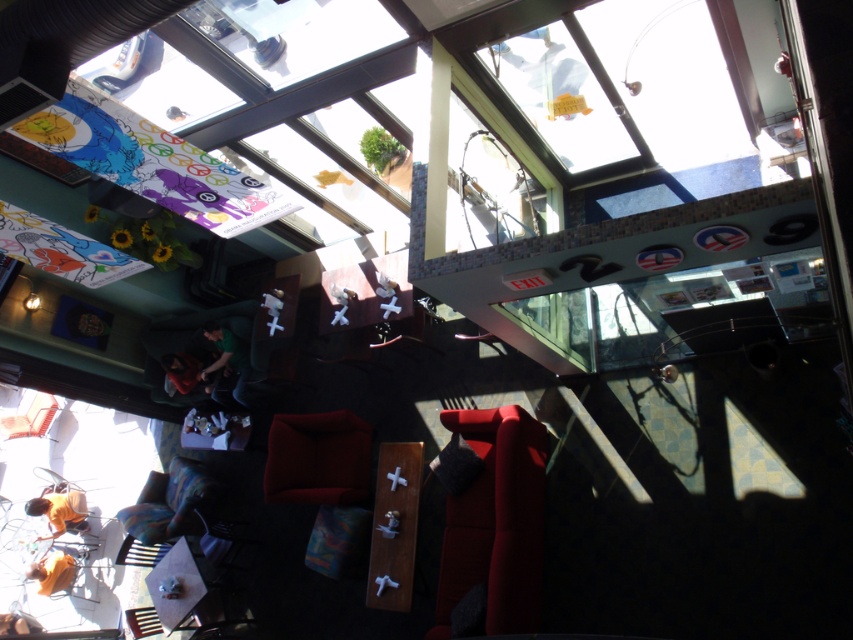
You are a customer looking for a seat in the modern themed cafe. You see the matte red chair at center and the multicolored fabric chair at lower left. Which chair takes up more space in the seating area?

The multicolored fabric chair at lower left takes up more space than the matte red chair at center.

You are a customer in the cafe and want to choose a seat that is taller than the other. Which chair should you choose between the matte red chair at center and the multicolored fabric chair at lower left?

The matte red chair at center has a greater height compared to the multicolored fabric chair at lower left, so you should choose the matte red chair at center.

You are a customer entering the cafe and see the orange fabric person at lower left and the matte orange chair at lower left. Which object is closer to the entrance?

The orange fabric person at lower left is closer to the entrance because they are positioned under the matte orange chair at lower left, indicating they are in front of it.